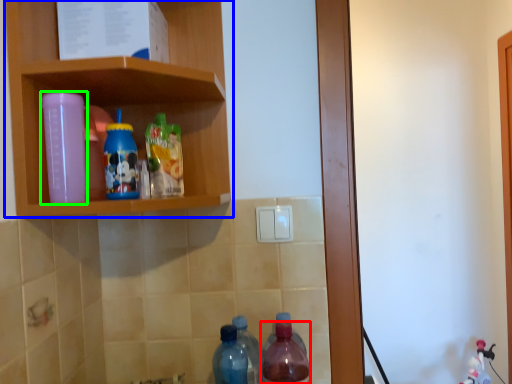
Question: Based on their relative distances, which object is farther from bottle (highlighted by a red box)? Choose from shelf (highlighted by a blue box) and bottle (highlighted by a green box).

Choices:
 (A) shelf
 (B) bottle

Answer: (B)